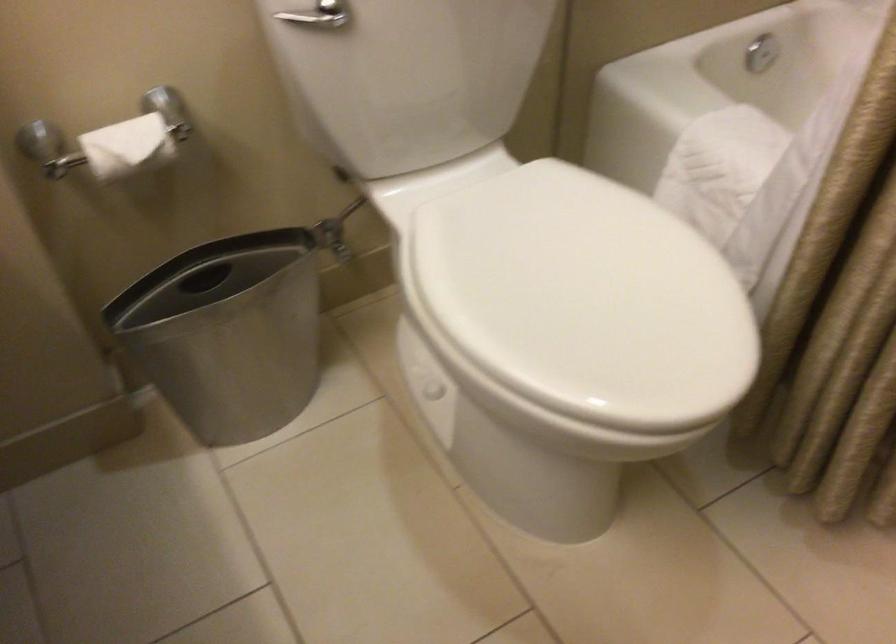
You are a GUI agent. You are given a task and a screenshot of the screen. Output one action in this format:
    pyautogui.click(x=<x>, y=<y>)
    Task: Click on the white toilet lid
    Image resolution: width=896 pixels, height=644 pixels.
    Given the screenshot: What is the action you would take?
    pyautogui.click(x=407, y=77)